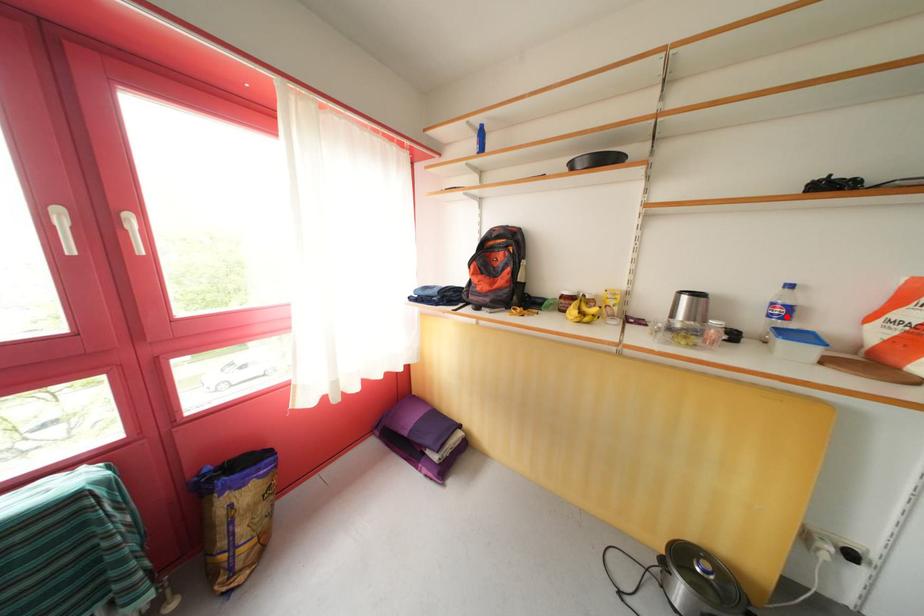
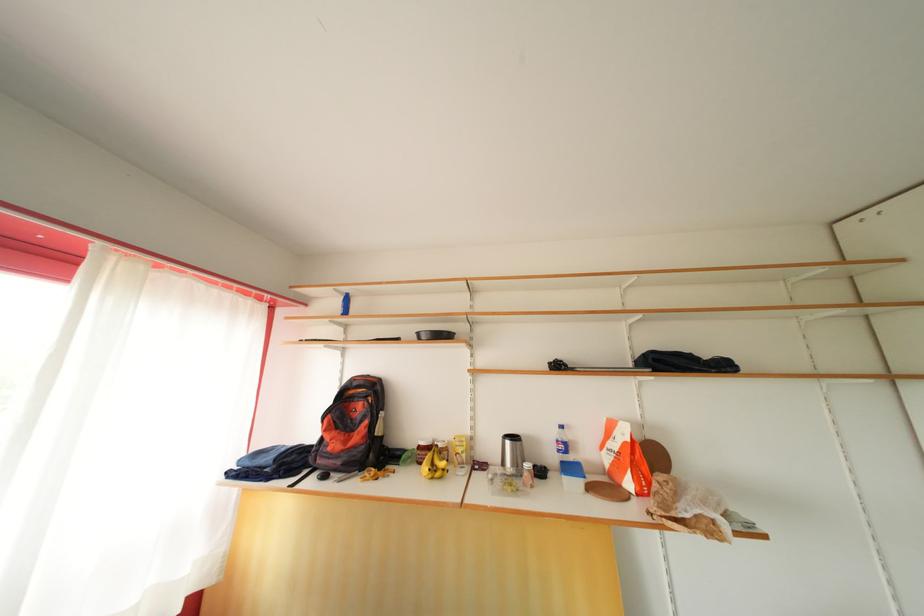
The point at the highlighted location is marked in the first image. Where is the corresponding point in the second image?

(568, 453)